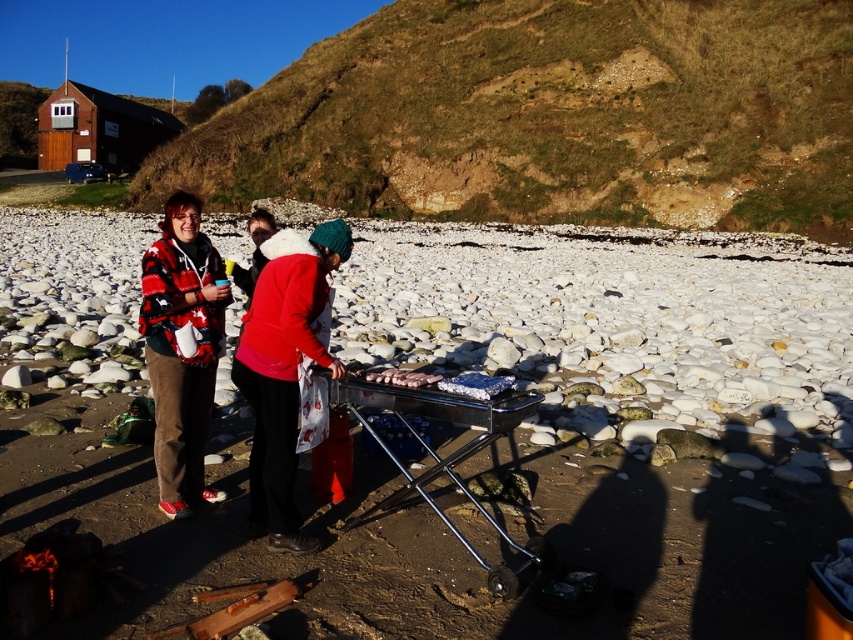
Does brown grassy hillside at upper center have a lesser width compared to metallic silver barbecue grill at center?

In fact, brown grassy hillside at upper center might be wider than metallic silver barbecue grill at center.

Is brown grassy hillside at upper center closer to the viewer compared to metallic silver barbecue grill at center?

No.

Where is `brown grassy hillside at upper center`? brown grassy hillside at upper center is located at coordinates (548, 116).

Who is higher up, stainless steel grill at center or metallic silver barbecue grill at center?

Positioned higher is stainless steel grill at center.

In the scene shown: Can you confirm if stainless steel grill at center is wider than metallic silver barbecue grill at center?

Yes, stainless steel grill at center is wider than metallic silver barbecue grill at center.

The height and width of the screenshot is (640, 853). Describe the element at coordinates (521, 442) in the screenshot. I see `stainless steel grill at center` at that location.

Locate an element on the screen. This screenshot has width=853, height=640. stainless steel grill at center is located at coordinates (521, 442).

Does brown grassy hillside at upper center appear on the left side of red fleece jacket at center?

No, brown grassy hillside at upper center is not to the left of red fleece jacket at center.

Can you confirm if brown grassy hillside at upper center is shorter than red fleece jacket at center?

Incorrect, brown grassy hillside at upper center's height does not fall short of red fleece jacket at center's.

Is point (509, 138) in front of point (329, 225)?

No, it is not.

The image size is (853, 640). Find the location of `brown grassy hillside at upper center`. brown grassy hillside at upper center is located at coordinates (548, 116).